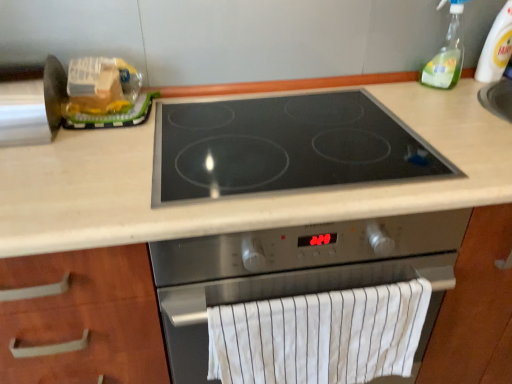
The image size is (512, 384). Find the location of `free spot to the left of clear plastic bottle at upper right`. free spot to the left of clear plastic bottle at upper right is located at coordinates (452, 90).